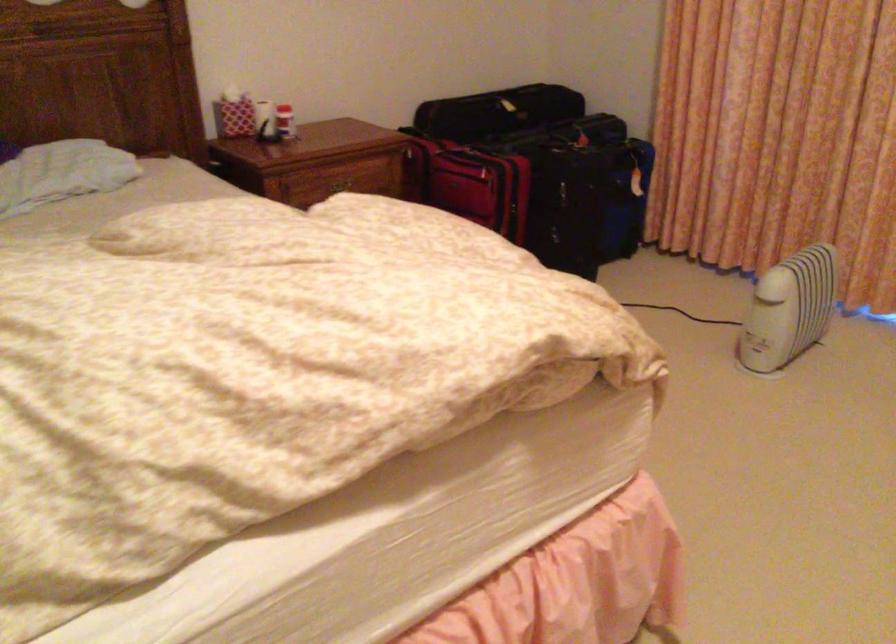
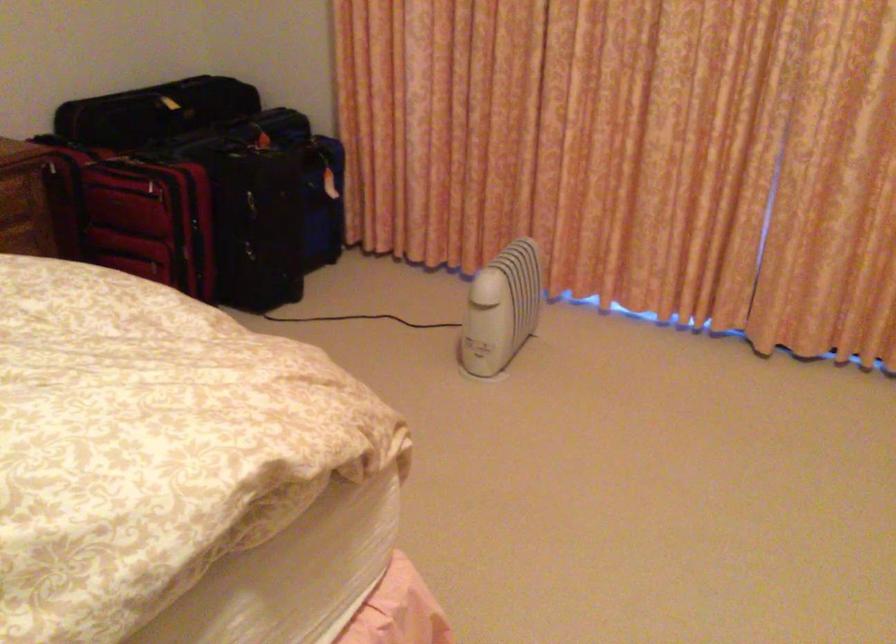
Question: In a continuous first-person perspective shot, in which direction is the camera moving?

Choices:
 (A) Left
 (B) Right
 (C) Forward
 (D) Backward

Answer: (C)